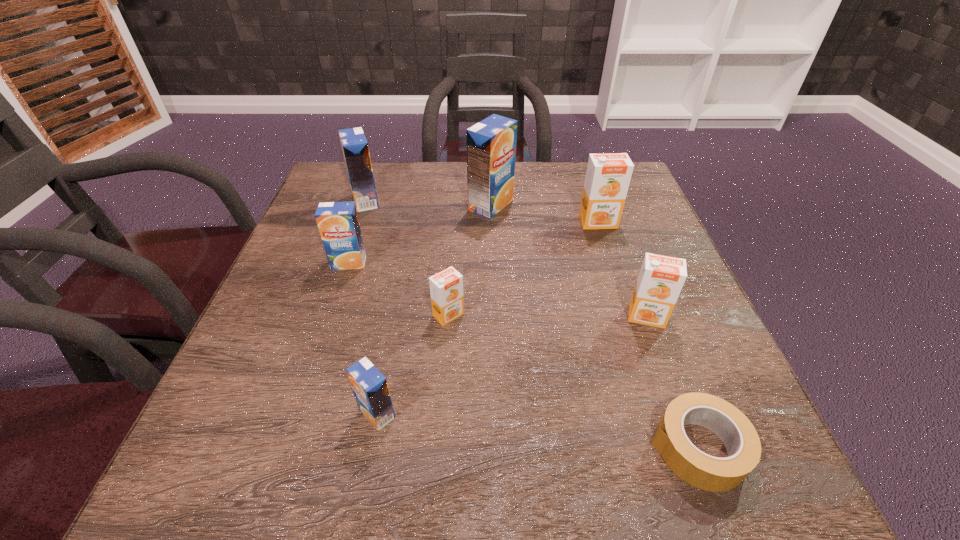
The image size is (960, 540). Identify the location of the fourth object from right to left. (491, 143).

Locate an element on the screen. The height and width of the screenshot is (540, 960). the fifth orange juice from left to right is located at coordinates (491, 143).

Where is `the third smallest blue orange_juice`? the third smallest blue orange_juice is located at coordinates (354, 145).

Identify the location of the biggest orange orange juice. The height and width of the screenshot is (540, 960). (608, 175).

Image resolution: width=960 pixels, height=540 pixels. I want to click on the third farthest blue orange_juice, so click(338, 224).

Identify the location of the fourth farthest object. The height and width of the screenshot is (540, 960). (338, 224).

Locate an element on the screen. the second smallest orange orange juice is located at coordinates (661, 278).

Locate an element on the screen. the fifth orange juice from right to left is located at coordinates (370, 388).

The height and width of the screenshot is (540, 960). In order to click on the nearest orange juice in this screenshot , I will do `click(370, 388)`.

Where is `the fifth object from right to left`? the fifth object from right to left is located at coordinates (446, 287).